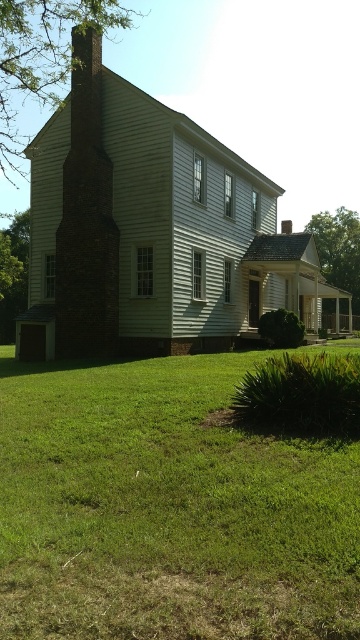
Does green grass at lower center appear under brick chimney at left?

Correct, green grass at lower center is located below brick chimney at left.

This screenshot has height=640, width=360. Describe the element at coordinates (168, 509) in the screenshot. I see `green grass at lower center` at that location.

Is point (124, 589) farther from viewer compared to point (91, 211)?

No, (124, 589) is in front of (91, 211).

At what (x,y) coordinates should I click in order to perform the action: click on green grass at lower center. Please return your answer as a coordinate pair (x, y). The width and height of the screenshot is (360, 640). Looking at the image, I should click on (168, 509).